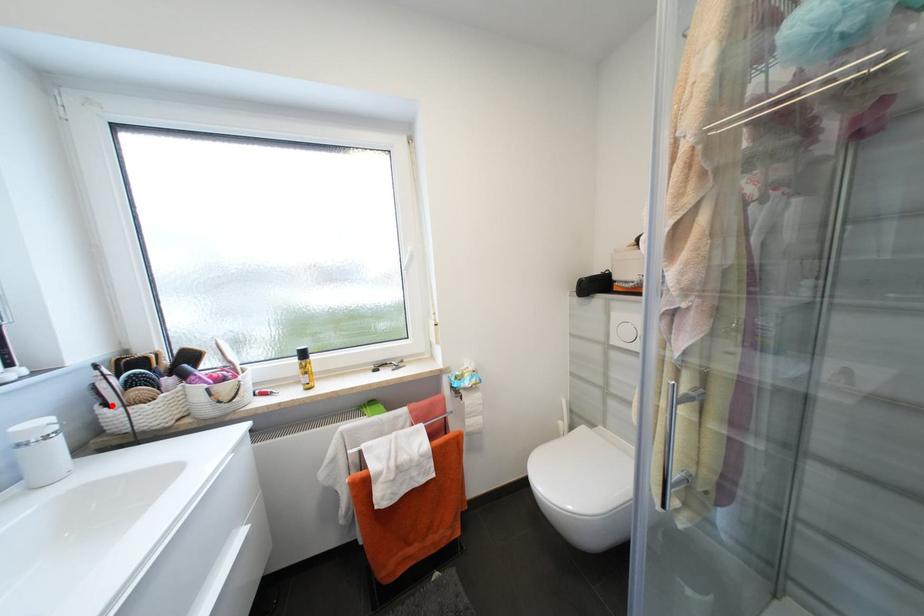
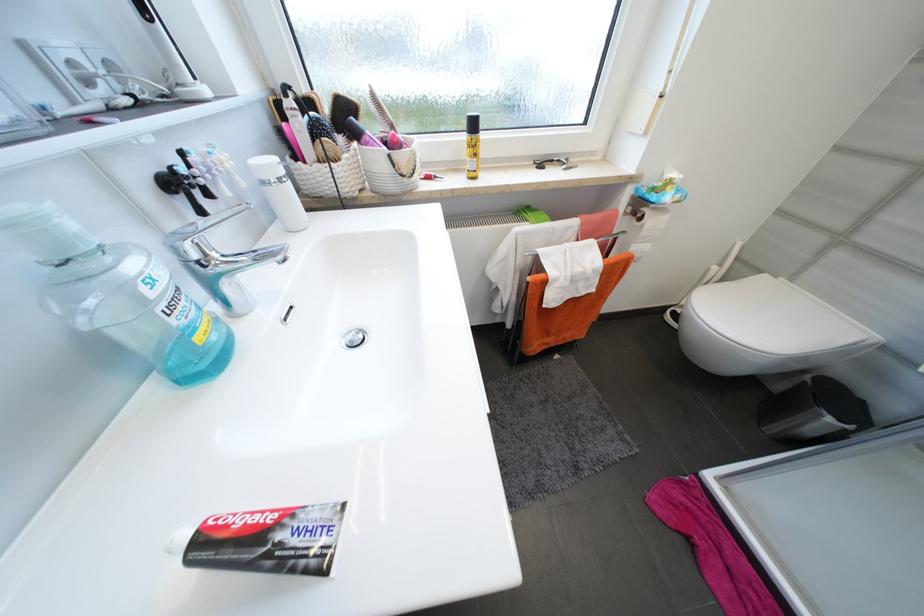
In the second image, find the point that corresponds to the highlighted location in the first image.

(304, 158)